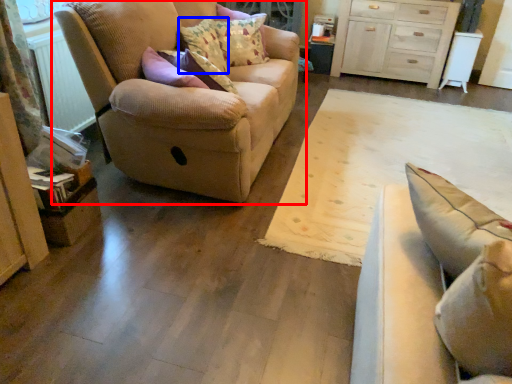
Question: Which object is closer to the camera taking this photo, studio couch (highlighted by a red box) or pillow (highlighted by a blue box)?

Choices:
 (A) studio couch
 (B) pillow

Answer: (A)